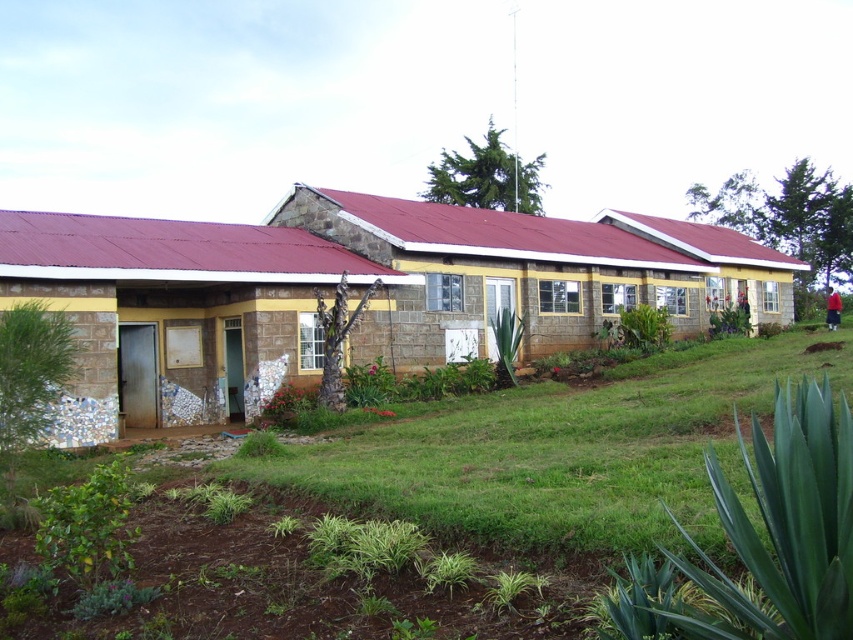
Question: Which point is farther to the camera?

Choices:
 (A) (289, 336)
 (B) (637, 397)
 (C) (480, 308)

Answer: (C)

Question: Is matte stone hut at left smaller than stone textured building at center?

Choices:
 (A) no
 (B) yes

Answer: (B)

Question: From the image, what is the correct spatial relationship of green grass at lower center in relation to matte stone hut at left?

Choices:
 (A) right
 (B) left

Answer: (A)

Question: Observing the image, what is the correct spatial positioning of green grass at lower center in reference to matte stone hut at left?

Choices:
 (A) below
 (B) above

Answer: (A)

Question: Which of the following is the farthest from the observer?

Choices:
 (A) (276, 330)
 (B) (663, 412)

Answer: (A)

Question: Which is farther from the stone textured building at center?

Choices:
 (A) green grass at lower center
 (B) matte stone hut at left

Answer: (A)